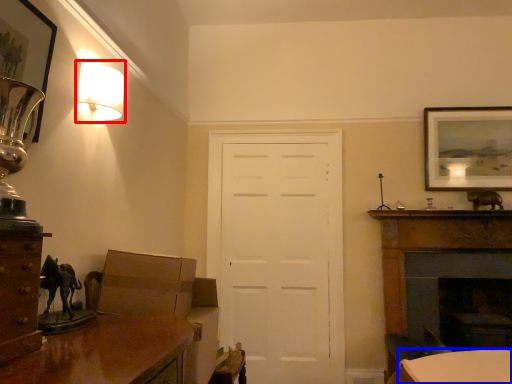
Question: Which object is further to the camera taking this photo, lamp (highlighted by a red box) or table (highlighted by a blue box)?

Choices:
 (A) lamp
 (B) table

Answer: (B)